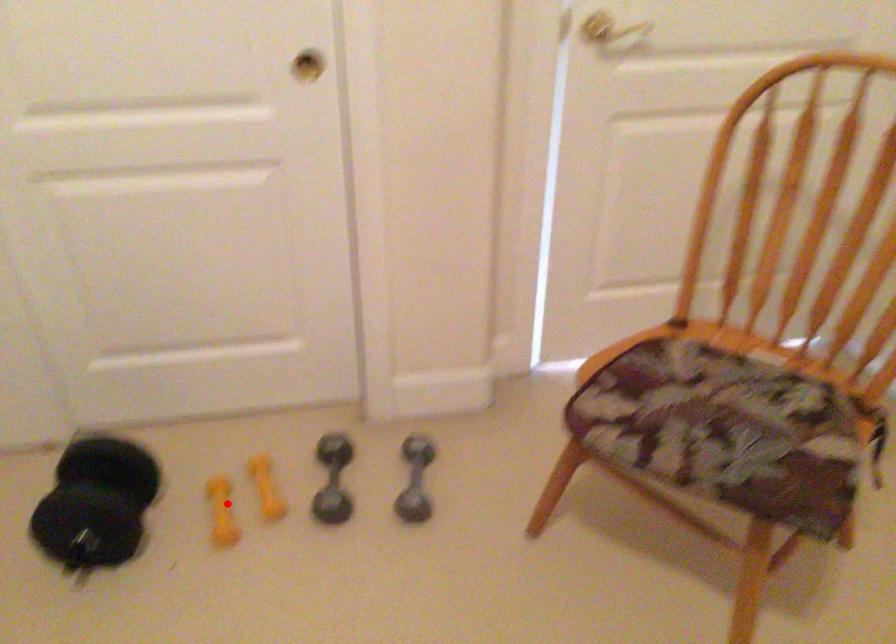
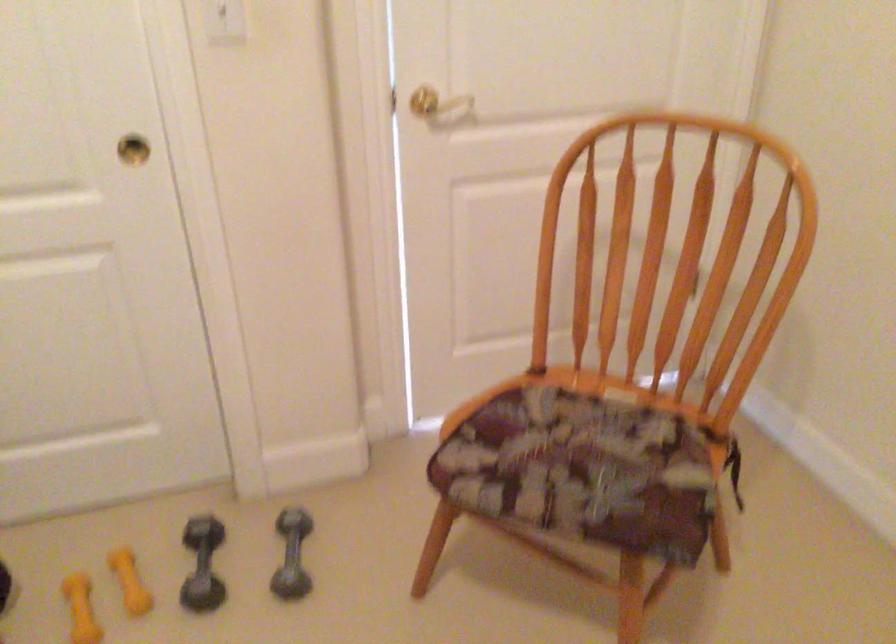
Where in the second image is the point corresponding to the highlighted location from the first image?

(81, 609)